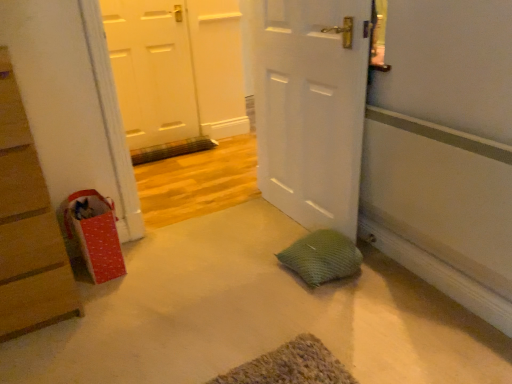
Find the location of `free space between red cardboard chest of drawers at left and green mesh pillow at center`. free space between red cardboard chest of drawers at left and green mesh pillow at center is located at coordinates (183, 285).